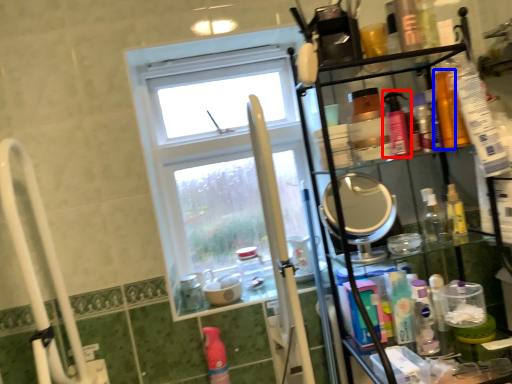
Question: Which object is further to the camera taking this photo, mouthwash (highlighted by a red box) or mouthwash (highlighted by a blue box)?

Choices:
 (A) mouthwash
 (B) mouthwash

Answer: (B)